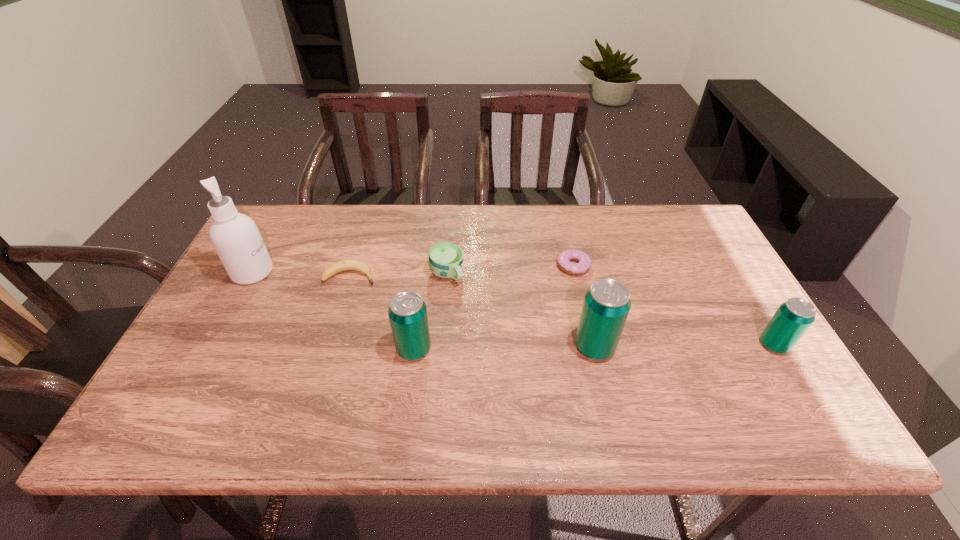
This screenshot has height=540, width=960. Find the location of `the second shortest beer can`. the second shortest beer can is located at coordinates (407, 312).

This screenshot has height=540, width=960. What are the coordinates of `the third tallest object` in the screenshot? It's located at (407, 312).

You are a GUI agent. You are given a task and a screenshot of the screen. Output one action in this format:
    pyautogui.click(x=<x>, y=<y>)
    Task: Click on the second beer can from right to left
    
    Given the screenshot: What is the action you would take?
    pyautogui.click(x=607, y=303)

Locate an element on the screen. This screenshot has width=960, height=540. the rightmost beer can is located at coordinates (792, 319).

You are a GUI agent. You are given a task and a screenshot of the screen. Output one action in this format:
    pyautogui.click(x=<x>, y=<y>)
    Task: Click on the shortest beer can
    
    Given the screenshot: What is the action you would take?
    pyautogui.click(x=792, y=319)

This screenshot has width=960, height=540. I want to click on cup, so click(445, 259).

Where is `cleansing agent`? The width and height of the screenshot is (960, 540). cleansing agent is located at coordinates (235, 237).

Find the location of a particular element. This screenshot has height=540, width=960. the leftmost object is located at coordinates (235, 237).

Where is `the second object from left to right`? the second object from left to right is located at coordinates (345, 265).

Locate an element on the screen. The height and width of the screenshot is (540, 960). doughnut is located at coordinates (564, 258).